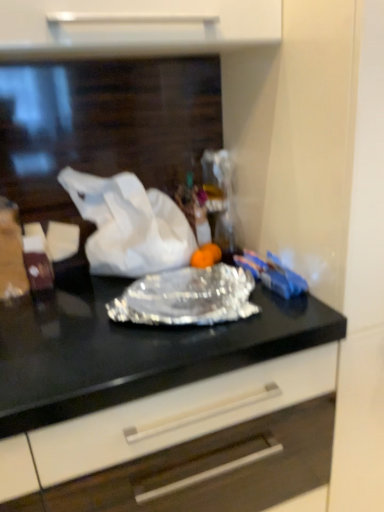
Question: Is shiny metallic foil at center to the right of silver foil wrap at center from the viewer's perspective?

Choices:
 (A) yes
 (B) no

Answer: (B)

Question: Can you confirm if shiny metallic foil at center is wider than silver foil wrap at center?

Choices:
 (A) yes
 (B) no

Answer: (A)

Question: Is shiny metallic foil at center not near silver foil wrap at center?

Choices:
 (A) no
 (B) yes

Answer: (A)

Question: Considering the relative sizes of shiny metallic foil at center and silver foil wrap at center in the image provided, is shiny metallic foil at center shorter than silver foil wrap at center?

Choices:
 (A) yes
 (B) no

Answer: (B)

Question: Is shiny metallic foil at center to the left of silver foil wrap at center from the viewer's perspective?

Choices:
 (A) yes
 (B) no

Answer: (A)

Question: Is white paper at center wider or thinner than silver foil wrap at center?

Choices:
 (A) thin
 (B) wide

Answer: (A)

Question: From the image's perspective, relative to silver foil wrap at center, is white paper at center above or below?

Choices:
 (A) above
 (B) below

Answer: (A)

Question: From a real-world perspective, is white paper at center physically located above or below silver foil wrap at center?

Choices:
 (A) above
 (B) below

Answer: (A)

Question: In the image, is white paper at center on the left side or the right side of silver foil wrap at center?

Choices:
 (A) left
 (B) right

Answer: (A)

Question: Is point (284, 307) closer or farther from the camera than point (115, 306)?

Choices:
 (A) farther
 (B) closer

Answer: (A)

Question: Would you say shiny metallic foil at center is to the left or to the right of silver foil wrap at center in the picture?

Choices:
 (A) left
 (B) right

Answer: (A)

Question: From the image's perspective, relative to silver foil wrap at center, is shiny metallic foil at center above or below?

Choices:
 (A) above
 (B) below

Answer: (B)

Question: In terms of height, does shiny metallic foil at center look taller or shorter compared to silver foil wrap at center?

Choices:
 (A) tall
 (B) short

Answer: (A)

Question: Considering the relative positions of shiny metallic foil at center and white paper at center in the image provided, is shiny metallic foil at center to the left or to the right of white paper at center?

Choices:
 (A) left
 (B) right

Answer: (B)

Question: Is point (249, 327) closer or farther from the camera than point (140, 233)?

Choices:
 (A) closer
 (B) farther

Answer: (A)